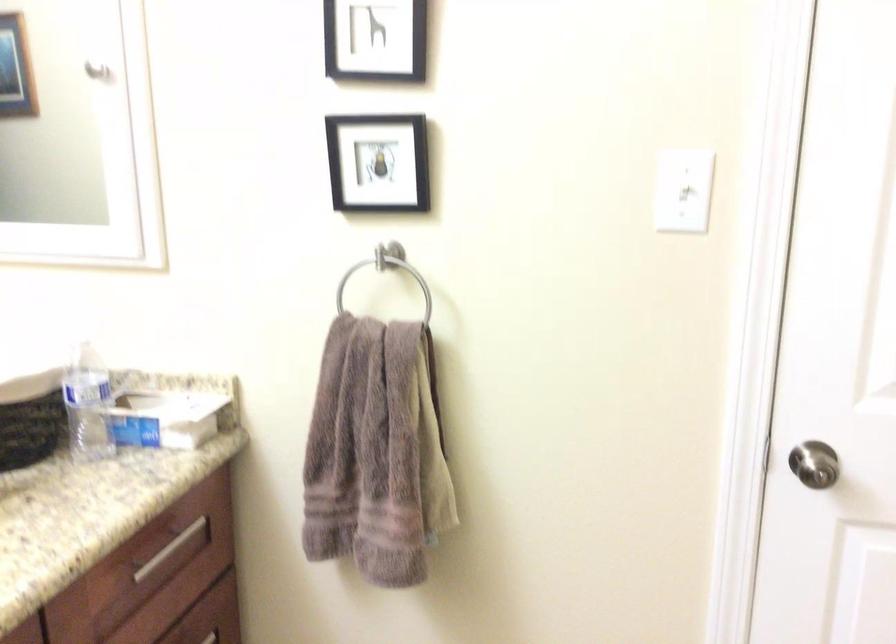
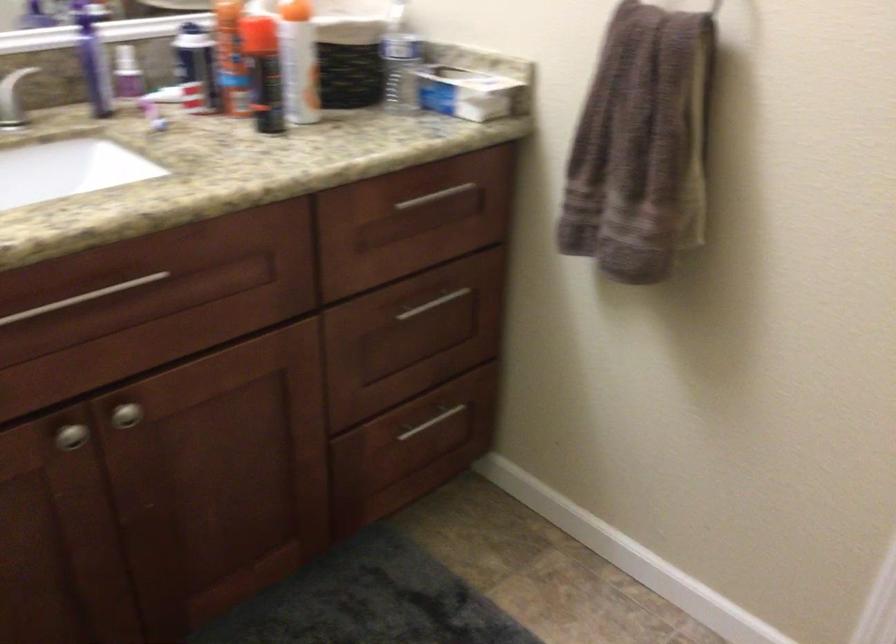
Find the pixel in the second image that matches point 181,544 in the first image.

(445, 201)